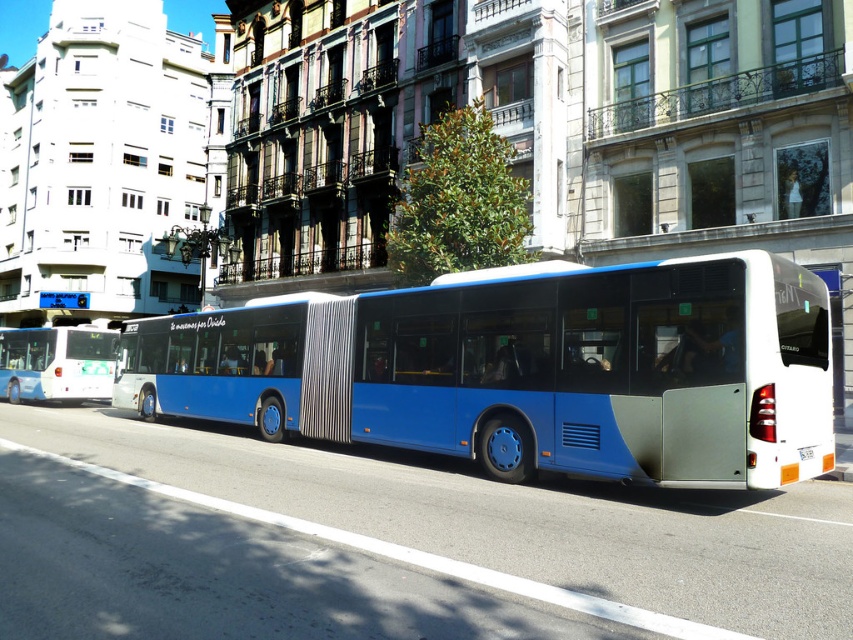
You are a pedestrian standing on the sidewalk. You see a blue metallic bus at center and a white glossy bus at left. Which bus is nearer to you?

The blue metallic bus at center is closer to the viewer than the white glossy bus at left, so the blue metallic bus at center is nearer to you.

You are a delivery person who needs to place a package on the blue metallic bus at center. The delivery zone is marked at point coordinates of (525, 369). Is the package placement location correct?

Yes, the package placement location is correct because the blue metallic bus at center is exactly at point coordinates of (525, 369).